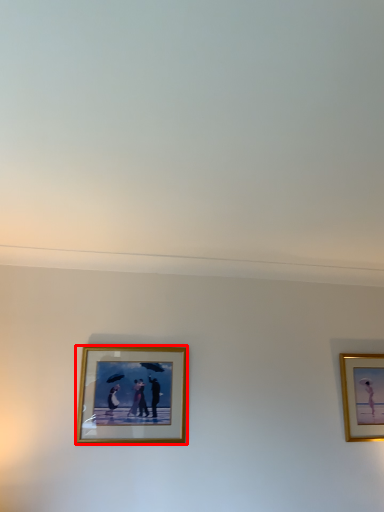
Question: In this image, where is picture frame (annotated by the red box) located relative to picture frame?

Choices:
 (A) left
 (B) right

Answer: (A)